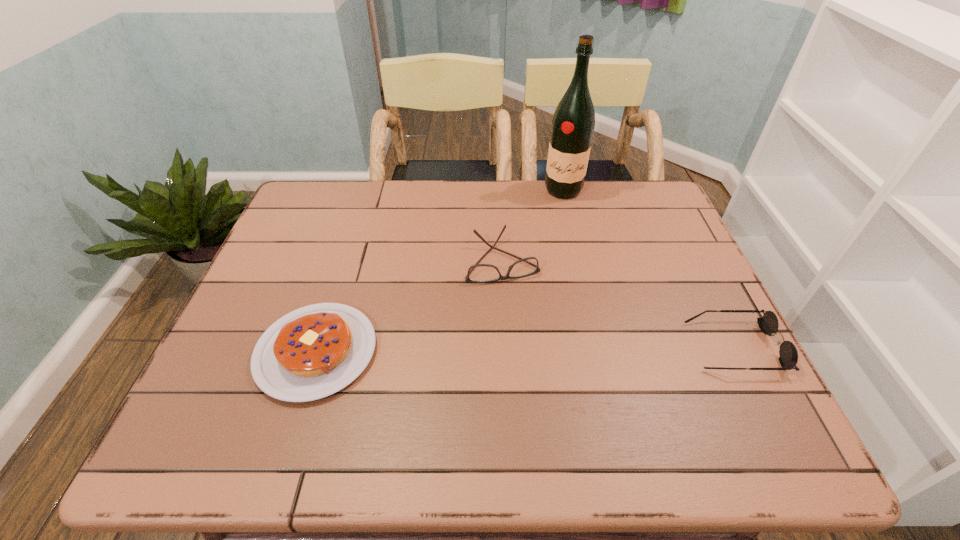
The image size is (960, 540). Find the location of `vacant space located on the front-facing side of the liquor`. vacant space located on the front-facing side of the liquor is located at coordinates (551, 273).

At what (x,y) coordinates should I click in order to perform the action: click on vacant space located on the front-facing side of the liquor. Please return your answer as a coordinate pair (x, y). This screenshot has height=540, width=960. Looking at the image, I should click on (557, 234).

Locate an element on the screen. The height and width of the screenshot is (540, 960). vacant space located 0.310m on the front-facing side of the liquor is located at coordinates (552, 267).

At what (x,y) coordinates should I click in order to perform the action: click on object that is at the far edge. Please return your answer as a coordinate pair (x, y). The image size is (960, 540). Looking at the image, I should click on (573, 123).

Identify the location of pancake present at the near edge. Image resolution: width=960 pixels, height=540 pixels. (312, 352).

Identify the location of sunglasses at the near edge. This screenshot has width=960, height=540. (768, 324).

In order to click on object present at the left edge in this screenshot , I will do `click(312, 352)`.

This screenshot has height=540, width=960. I want to click on object that is at the right edge, so click(768, 324).

The height and width of the screenshot is (540, 960). What are the coordinates of `object at the near left corner` in the screenshot? It's located at (312, 352).

Where is `object positioned at the near right corner`? object positioned at the near right corner is located at coordinates (768, 324).